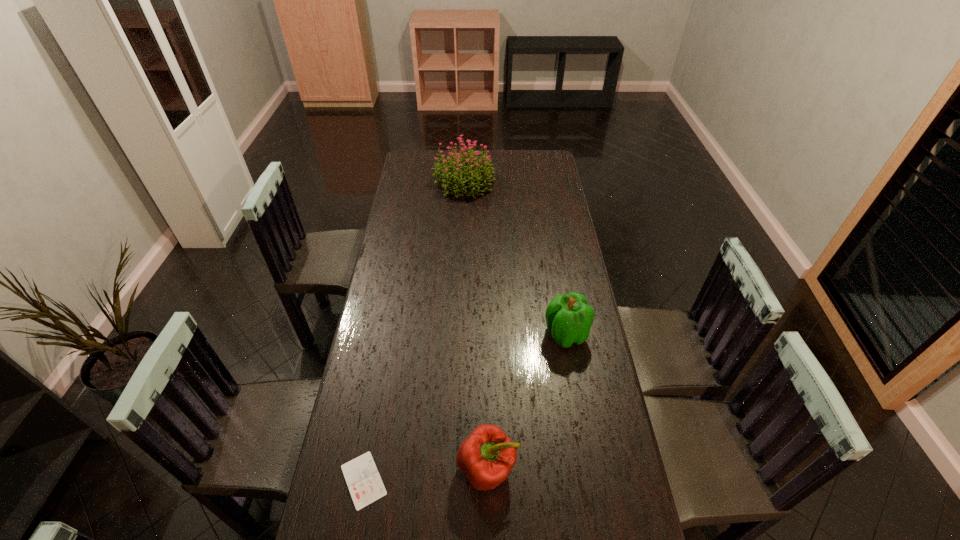
Locate an element on the screen. The height and width of the screenshot is (540, 960). vacant space located 0.280m on the right of the nearer bell pepper is located at coordinates (622, 469).

Find the location of a particular element. vacant space situated 0.050m on the right of the diary is located at coordinates (408, 480).

Image resolution: width=960 pixels, height=540 pixels. I want to click on object that is positioned at the far edge, so click(453, 171).

Identify the location of bouquet situated at the left edge. (453, 171).

Locate an element on the screen. The width and height of the screenshot is (960, 540). diary that is at the left edge is located at coordinates (365, 485).

You are a GUI agent. You are given a task and a screenshot of the screen. Output one action in this format:
    pyautogui.click(x=<x>, y=<y>)
    Task: Click on the object that is at the right edge
    
    Given the screenshot: What is the action you would take?
    pyautogui.click(x=569, y=318)

You are a GUI agent. You are given a task and a screenshot of the screen. Output one action in this format:
    pyautogui.click(x=<x>, y=<y>)
    Task: Click on the object present at the far left corner
    Image resolution: width=960 pixels, height=540 pixels.
    Given the screenshot: What is the action you would take?
    [x=453, y=171]

The image size is (960, 540). Find the location of `free spot at the left edge of the desktop`. free spot at the left edge of the desktop is located at coordinates (411, 188).

Image resolution: width=960 pixels, height=540 pixels. Identify the location of free space at the right edge of the desktop. (546, 267).

Locate an element on the screen. This screenshot has width=960, height=540. vacant space at the far right corner of the desktop is located at coordinates (533, 171).